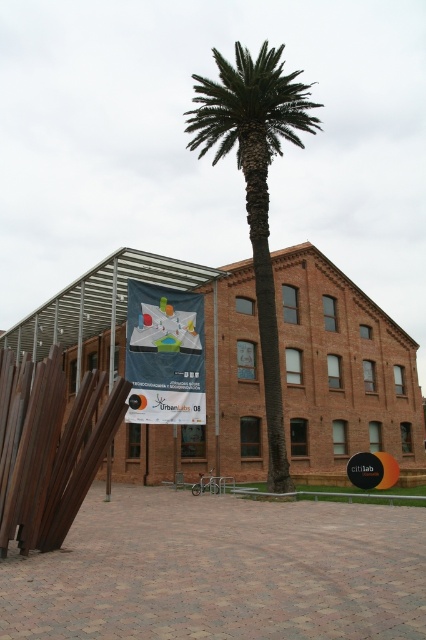
You are a city planner reviewing this urban space. You need to install a new bench that must be placed between the green leafy palm at center and the smooth metal pole at center. According to the scene description, which object should the bench be closer to?

The bench should be placed closer to the smooth metal pole at center because the green leafy palm at center is positioned on the right side of the smooth metal pole at center, meaning the palm is to the right of the pole. Therefore, the bench between them should be closer to the pole to maintain symmetry or alignment with the existing layout.

You are a city planner assessing the layout of this urban space. You need to determine if the green leafy palm at center will block the view of the brushed metal pole at left from the main walkway. Based on their positions, what is your assessment?

The green leafy palm at center is positioned over the brushed metal pole at left, so it will block the view of the brushed metal pole at left from the main walkway.

You are a city planner reviewing the urban layout. The green leafy palm at center is crucial for shade. Can you confirm its exact coordinates to ensure proper sunlight exposure?

The green leafy palm at center is located at point (256, 186), which means it is positioned to provide optimal shade based on sunlight calculations.